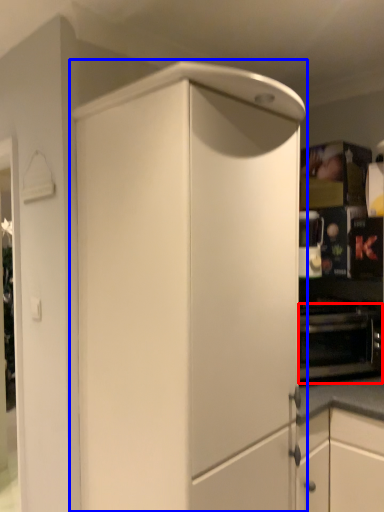
Question: Among these objects, which one is farthest to the camera, oven (highlighted by a red box) or cabinetry (highlighted by a blue box)?

Choices:
 (A) oven
 (B) cabinetry

Answer: (A)